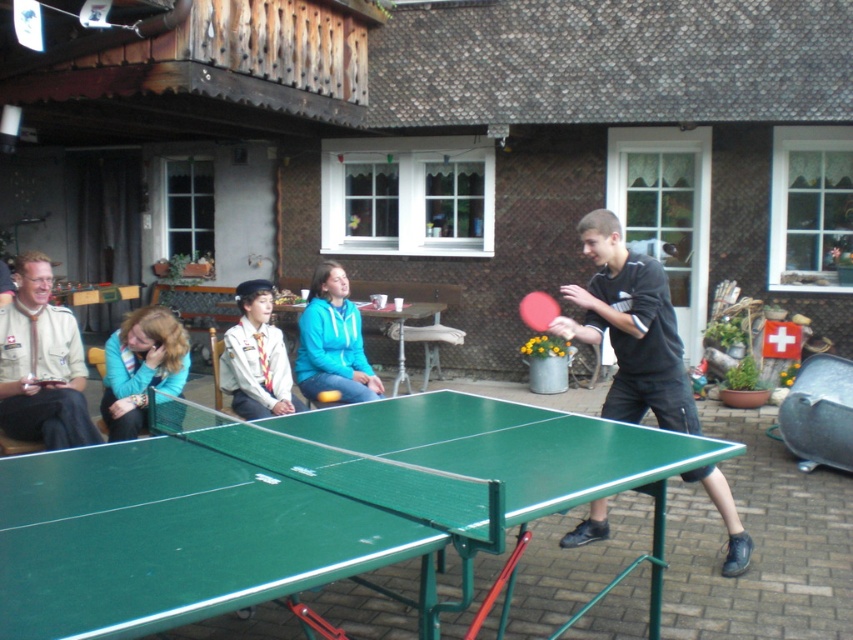
Question: Is black matte ping pong paddle at right bigger than green plastic table tennis table at center?

Choices:
 (A) yes
 (B) no

Answer: (A)

Question: Which point is farther to the camera?

Choices:
 (A) light blue uniform at center
 (B) green plastic table tennis table at center

Answer: (B)

Question: Is green plastic table at center above rubber paddle at right?

Choices:
 (A) no
 (B) yes

Answer: (A)

Question: Is matte blue jacket at center bigger than light blue uniform at center?

Choices:
 (A) yes
 (B) no

Answer: (A)

Question: Which point is farther to the camera?

Choices:
 (A) light blue uniform at center
 (B) matte blue jacket at center
 (C) black matte ping pong paddle at right
 (D) beige uniform at left

Answer: (B)

Question: Which point is farther to the camera?

Choices:
 (A) rubber paddle at right
 (B) green plastic table at center

Answer: (A)